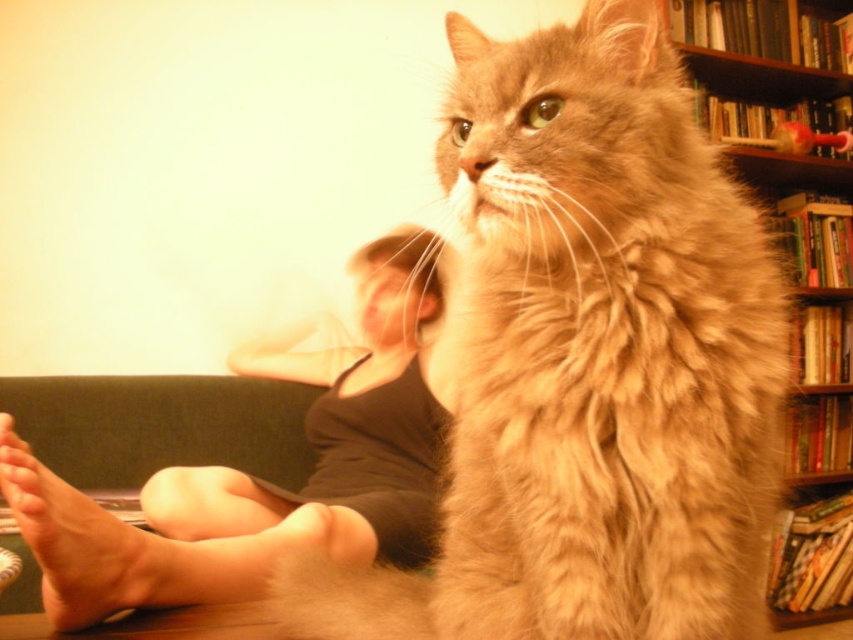
You are a cat owner who wants to ensure your cat has enough space to move comfortably on the table. The cat is currently sitting between the smooth skin legs at lower left and the dark green fabric couch at lower left. Can the cat move freely between these two objects?

The distance between the smooth skin legs at lower left and the dark green fabric couch at lower left is 13.16 inches. Since cats typically need at least 12 inches of space to move comfortably, the cat has enough room to move freely between these two objects.

You are a photographer trying to capture the cat sitting on the table. You notice the smooth skin legs at lower left and the dark green fabric couch at lower left in the background. Which object is bigger in the photo?

The smooth skin legs at lower left is larger in size compared to the dark green fabric couch at lower left in the photo.